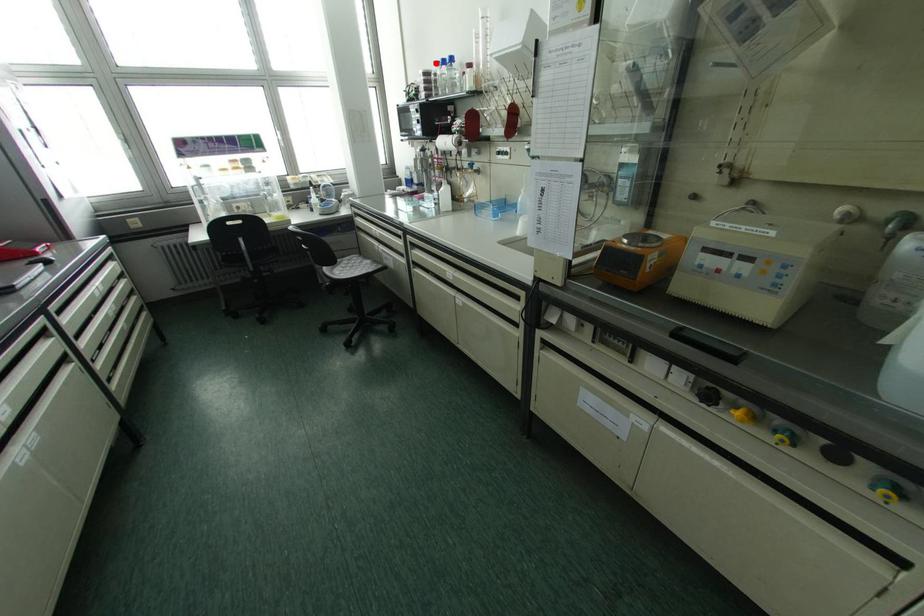
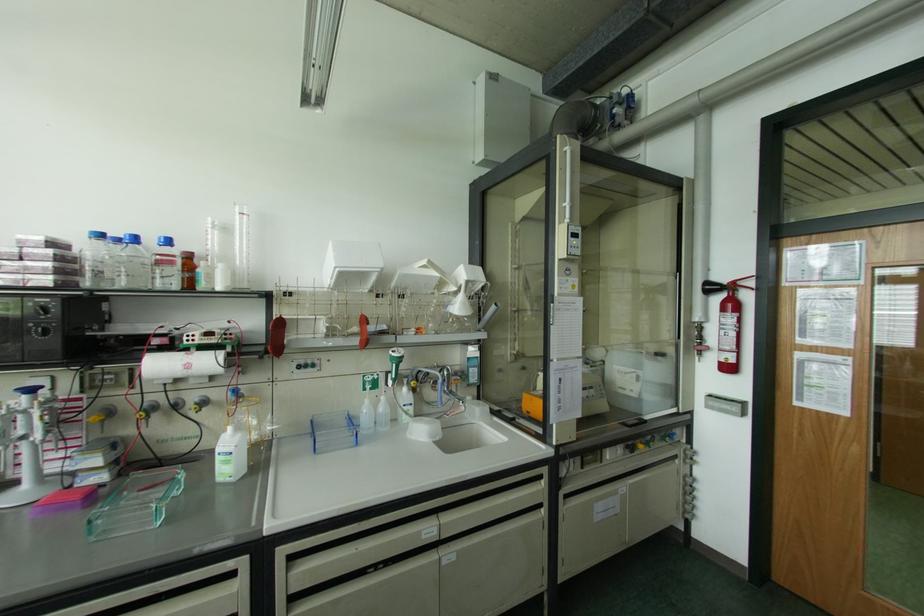
In the second image, find the point that corresponds to the highlighted location in the first image.

(101, 236)